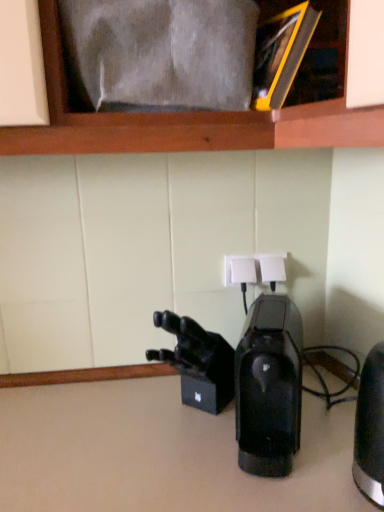
At what (x,y) coordinates should I click in order to perform the action: click on black glossy coffee maker at center, marked as the second home appliance in a right-to-left arrangement. Please return your answer as a coordinate pair (x, y). The height and width of the screenshot is (512, 384). Looking at the image, I should click on (269, 387).

Locate an element on the screen. white plastic electrical outlet at center is located at coordinates (255, 269).

Between black metallic kettle at right, which is counted as the 2th home appliance, starting from the left, and black glossy coffee maker at center, marked as the second home appliance in a right-to-left arrangement, which one has larger size?

black metallic kettle at right, which is counted as the 2th home appliance, starting from the left, is bigger.

Can you confirm if black metallic kettle at right, which is counted as the 1th home appliance, starting from the right, is thinner than black glossy coffee maker at center, marked as the second home appliance in a right-to-left arrangement?

Correct, the width of black metallic kettle at right, which is counted as the 1th home appliance, starting from the right, is less than that of black glossy coffee maker at center, marked as the second home appliance in a right-to-left arrangement.

Is black metallic kettle at right, which is counted as the 2th home appliance, starting from the left, far from black glossy coffee maker at center, the 1th home appliance when ordered from left to right?

No, there isn't a large distance between black metallic kettle at right, which is counted as the 2th home appliance, starting from the left, and black glossy coffee maker at center, the 1th home appliance when ordered from left to right.

Can you confirm if black glossy coffee maker at center, marked as the second home appliance in a right-to-left arrangement, is positioned to the right of white plastic electrical outlet at center?

Incorrect, black glossy coffee maker at center, marked as the second home appliance in a right-to-left arrangement, is not on the right side of white plastic electrical outlet at center.

Considering the relative sizes of black glossy coffee maker at center, marked as the second home appliance in a right-to-left arrangement, and white plastic electrical outlet at center in the image provided, is black glossy coffee maker at center, marked as the second home appliance in a right-to-left arrangement, shorter than white plastic electrical outlet at center?

No.

From a real-world perspective, which is physically below, black glossy coffee maker at center, marked as the second home appliance in a right-to-left arrangement, or white plastic electrical outlet at center?

black glossy coffee maker at center, marked as the second home appliance in a right-to-left arrangement.

This screenshot has width=384, height=512. In order to click on video camera on the left of white plastic electrical outlet at center in this screenshot , I will do `click(197, 362)`.

Is white plastic electrical outlet at center located outside black matte/video camera at center?

Indeed, white plastic electrical outlet at center is completely outside black matte/video camera at center.

From the image's perspective, would you say white plastic electrical outlet at center is positioned over black matte/video camera at center?

Yes, from the image's perspective, white plastic electrical outlet at center is above black matte/video camera at center.

Is point (261, 258) behind point (195, 352)?

Yes, it is.

From a real-world perspective, between black glossy coffee maker at center, the 1th home appliance when ordered from left to right, and black metallic kettle at right, which is counted as the 1th home appliance, starting from the right, who is vertically lower?

black glossy coffee maker at center, the 1th home appliance when ordered from left to right, is physically lower.

Is black glossy coffee maker at center, the 1th home appliance when ordered from left to right, oriented towards black metallic kettle at right, which is counted as the 2th home appliance, starting from the left?

No.

Is point (287, 304) more distant than point (358, 405)?

Yes, point (287, 304) is farther from viewer.

How different are the orientations of black glossy coffee maker at center, the 1th home appliance when ordered from left to right, and black metallic kettle at right, which is counted as the 1th home appliance, starting from the right, in degrees?

0.0783 degrees.

Based on the photo, can you tell me how much black matte/video camera at center and black glossy coffee maker at center, marked as the second home appliance in a right-to-left arrangement, differ in facing direction?

The angle between the facing direction of black matte/video camera at center and the facing direction of black glossy coffee maker at center, marked as the second home appliance in a right-to-left arrangement, is 40.4 degrees.

Identify the location of video camera behind the black glossy coffee maker at center, marked as the second home appliance in a right-to-left arrangement. click(197, 362).

Which of these two, black matte/video camera at center or black glossy coffee maker at center, marked as the second home appliance in a right-to-left arrangement, is wider?

Wider between the two is black glossy coffee maker at center, marked as the second home appliance in a right-to-left arrangement.

Is black matte/video camera at center turned away from black glossy coffee maker at center, the 1th home appliance when ordered from left to right?

No, black glossy coffee maker at center, the 1th home appliance when ordered from left to right, is not at the back of black matte/video camera at center.

Between black metallic kettle at right, which is counted as the 1th home appliance, starting from the right, and black matte/video camera at center, which one has smaller width?

Thinner between the two is black metallic kettle at right, which is counted as the 1th home appliance, starting from the right.

Is black metallic kettle at right, which is counted as the 2th home appliance, starting from the left, placed right next to black matte/video camera at center?

No, black metallic kettle at right, which is counted as the 2th home appliance, starting from the left, is not with black matte/video camera at center.

Is black matte/video camera at center at the back of black metallic kettle at right, which is counted as the 2th home appliance, starting from the left?

No, black metallic kettle at right, which is counted as the 2th home appliance, starting from the left,'s orientation is not away from black matte/video camera at center.

Is black metallic kettle at right, which is counted as the 2th home appliance, starting from the left, inside the boundaries of black matte/video camera at center, or outside?

black metallic kettle at right, which is counted as the 2th home appliance, starting from the left, is spatially situated outside black matte/video camera at center.

What are the coordinates of `video camera on the left of black metallic kettle at right, which is counted as the 2th home appliance, starting from the left` in the screenshot? It's located at (197, 362).

Is black matte/video camera at center in front of or behind black metallic kettle at right, which is counted as the 1th home appliance, starting from the right, in the image?

black matte/video camera at center is positioned farther from the viewer than black metallic kettle at right, which is counted as the 1th home appliance, starting from the right.

Is black matte/video camera at center at the left side of black metallic kettle at right, which is counted as the 2th home appliance, starting from the left?

Indeed, black matte/video camera at center is positioned on the left side of black metallic kettle at right, which is counted as the 2th home appliance, starting from the left.

From a real-world perspective, is black matte/video camera at center on black metallic kettle at right, which is counted as the 1th home appliance, starting from the right?

No, from a real-world perspective, black matte/video camera at center is not over black metallic kettle at right, which is counted as the 1th home appliance, starting from the right

This screenshot has height=512, width=384. There is a black glossy coffee maker at center, marked as the second home appliance in a right-to-left arrangement. In order to click on home appliance above it (from a real-world perspective) in this screenshot , I will do `click(370, 428)`.

Where is `the 2nd home appliance located beneath the white plastic electrical outlet at center (from a real-world perspective)`? the 2nd home appliance located beneath the white plastic electrical outlet at center (from a real-world perspective) is located at coordinates (269, 387).

Based on their spatial positions, is white plastic electrical outlet at center or black metallic kettle at right, which is counted as the 1th home appliance, starting from the right, closer to black glossy coffee maker at center, the 1th home appliance when ordered from left to right?

black metallic kettle at right, which is counted as the 1th home appliance, starting from the right, is closer to black glossy coffee maker at center, the 1th home appliance when ordered from left to right.

From the image, which object appears to be farther from black matte/video camera at center, black glossy coffee maker at center, the 1th home appliance when ordered from left to right, or black metallic kettle at right, which is counted as the 1th home appliance, starting from the right?

black metallic kettle at right, which is counted as the 1th home appliance, starting from the right, is further to black matte/video camera at center.

Considering their positions, is black metallic kettle at right, which is counted as the 2th home appliance, starting from the left, positioned further to black matte/video camera at center than white plastic electrical outlet at center?

The object further to black matte/video camera at center is black metallic kettle at right, which is counted as the 2th home appliance, starting from the left.

Estimate the real-world distances between objects in this image. Which object is further from black matte/video camera at center, black metallic kettle at right, which is counted as the 2th home appliance, starting from the left, or black glossy coffee maker at center, the 1th home appliance when ordered from left to right?

black metallic kettle at right, which is counted as the 2th home appliance, starting from the left, lies further to black matte/video camera at center than the other object.

Considering their positions, is black matte/video camera at center positioned closer to white plastic electrical outlet at center than black metallic kettle at right, which is counted as the 1th home appliance, starting from the right?

Based on the image, black matte/video camera at center appears to be nearer to white plastic electrical outlet at center.

When comparing their distances from black metallic kettle at right, which is counted as the 2th home appliance, starting from the left, does black glossy coffee maker at center, marked as the second home appliance in a right-to-left arrangement, or black matte/video camera at center seem closer?

black glossy coffee maker at center, marked as the second home appliance in a right-to-left arrangement, is positioned closer to the anchor black metallic kettle at right, which is counted as the 2th home appliance, starting from the left.

Considering their positions, is white plastic electrical outlet at center positioned further to black metallic kettle at right, which is counted as the 2th home appliance, starting from the left, than black glossy coffee maker at center, the 1th home appliance when ordered from left to right?

white plastic electrical outlet at center is further to black metallic kettle at right, which is counted as the 2th home appliance, starting from the left.

When comparing their distances from black matte/video camera at center, does white plastic electrical outlet at center or black metallic kettle at right, which is counted as the 1th home appliance, starting from the right, seem further?

black metallic kettle at right, which is counted as the 1th home appliance, starting from the right.

Where is `video camera located between black metallic kettle at right, which is counted as the 2th home appliance, starting from the left, and white plastic electrical outlet at center in the depth direction`? The image size is (384, 512). video camera located between black metallic kettle at right, which is counted as the 2th home appliance, starting from the left, and white plastic electrical outlet at center in the depth direction is located at coordinates (197, 362).

This screenshot has height=512, width=384. I want to click on home appliance between black metallic kettle at right, which is counted as the 2th home appliance, starting from the left, and white plastic electrical outlet at center, along the z-axis, so click(x=269, y=387).

At what (x,y) coordinates should I click in order to perform the action: click on video camera between black glossy coffee maker at center, the 1th home appliance when ordered from left to right, and white plastic electrical outlet at center, along the z-axis. Please return your answer as a coordinate pair (x, y). The height and width of the screenshot is (512, 384). Looking at the image, I should click on (197, 362).

At what (x,y) coordinates should I click in order to perform the action: click on home appliance between black matte/video camera at center and black metallic kettle at right, which is counted as the 2th home appliance, starting from the left, in the horizontal direction. Please return your answer as a coordinate pair (x, y). The height and width of the screenshot is (512, 384). Looking at the image, I should click on (269, 387).